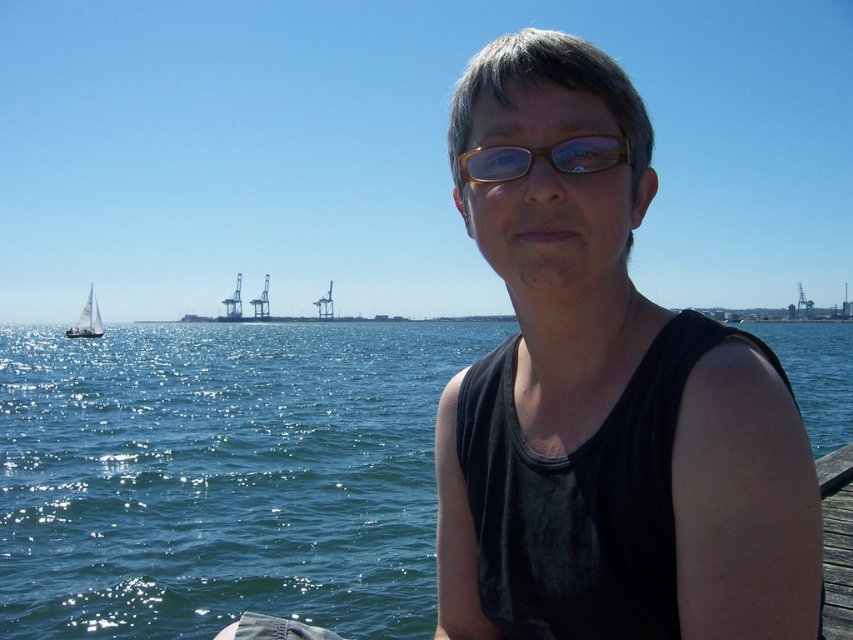
You are taking a photo of the scene and want to focus on both the point at coordinates point (734,433) and point (467,176). Which point should you adjust your focus to ensure both are in sharp detail?

To ensure both points are in sharp detail, focus on the point that is farther from the camera. Since point (467,176) is farther away than point (734,433), you should focus on point (467,176). This will create a depth of field that includes both points.

You are a photographer trying to capture the wooden at right in your shot. Based on its position, where should you aim your camera to ensure it is centered in the frame?

To center the wooden at right in the frame, aim your camera at the coordinates corresponding to the midpoint of the wooden at right. Since the wooden at right is located at point [837,540], you would adjust your camera to focus on this position to center it.